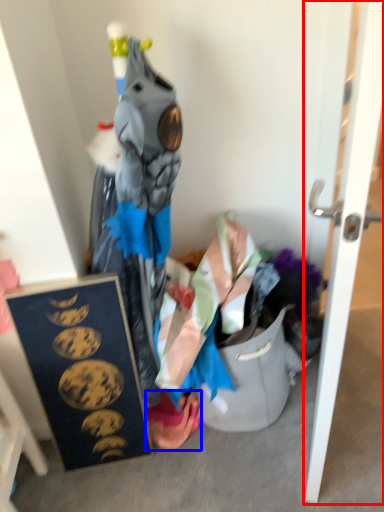
Question: Which object appears farthest to the camera in this image, door (highlighted by a red box) or underclothes (highlighted by a blue box)?

Choices:
 (A) door
 (B) underclothes

Answer: (B)